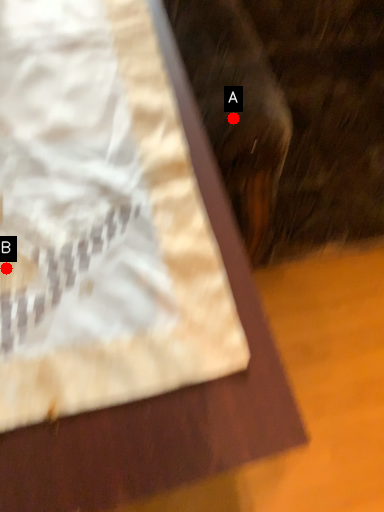
Question: Two points are circled on the image, labeled by A and B beside each circle. Which point is further to the camera?

Choices:
 (A) A is further
 (B) B is further

Answer: (A)